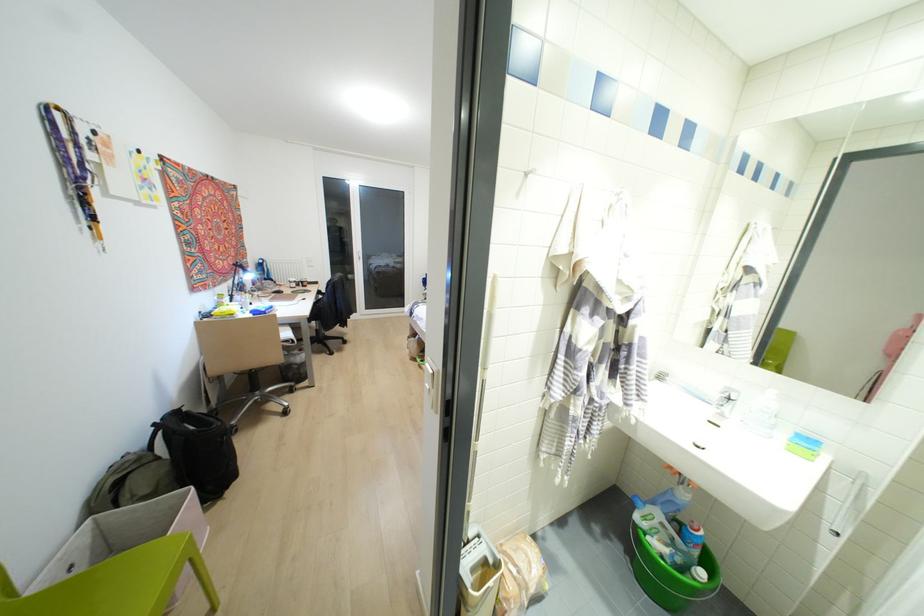
The width and height of the screenshot is (924, 616). In order to click on trash can pedal in this screenshot , I will do `click(480, 590)`.